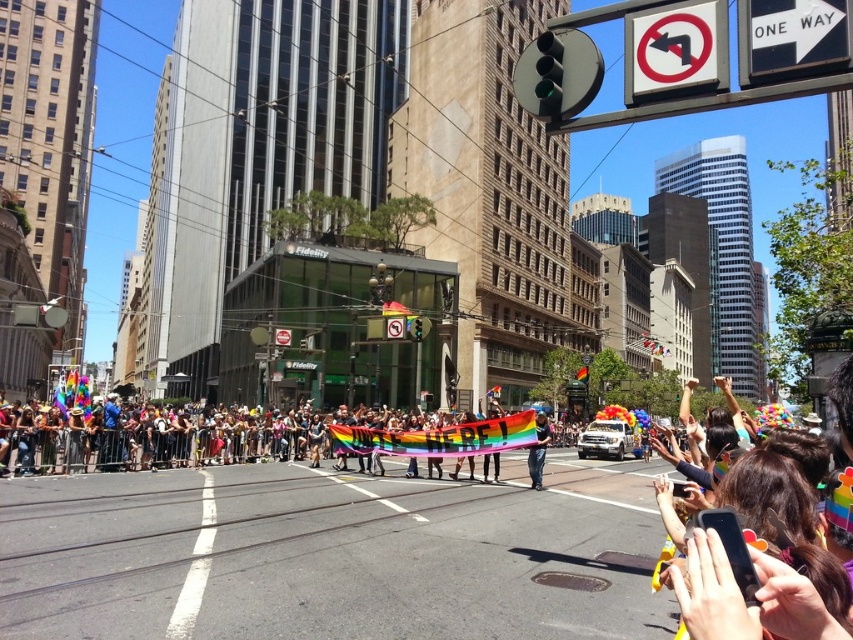
Between point (761, 595) and point (544, 436), which one is positioned behind?

Positioned behind is point (544, 436).

Is point (704, 577) more distant than point (537, 460)?

No, (704, 577) is in front of (537, 460).

Where is `multicolored hair at center`? The height and width of the screenshot is (640, 853). multicolored hair at center is located at coordinates (743, 600).

The height and width of the screenshot is (640, 853). Find the location of `multicolored hair at center`. multicolored hair at center is located at coordinates (743, 600).

Is point (503, 433) farther from camera compared to point (698, 561)?

That is True.

Between rainbow fabric banner at center and multicolored hair at center, which one is positioned higher?

Positioned higher is multicolored hair at center.

Locate an element on the screen. This screenshot has width=853, height=640. rainbow fabric banner at center is located at coordinates (254, 440).

Who is more forward, (283, 451) or (538, 467)?

Positioned in front is point (538, 467).

Based on the photo, does rainbow fabric banner at center appear on the left side of rainbow flag at center?

Yes, rainbow fabric banner at center is to the left of rainbow flag at center.

Image resolution: width=853 pixels, height=640 pixels. What are the coordinates of `rainbow fabric banner at center` in the screenshot? It's located at (254, 440).